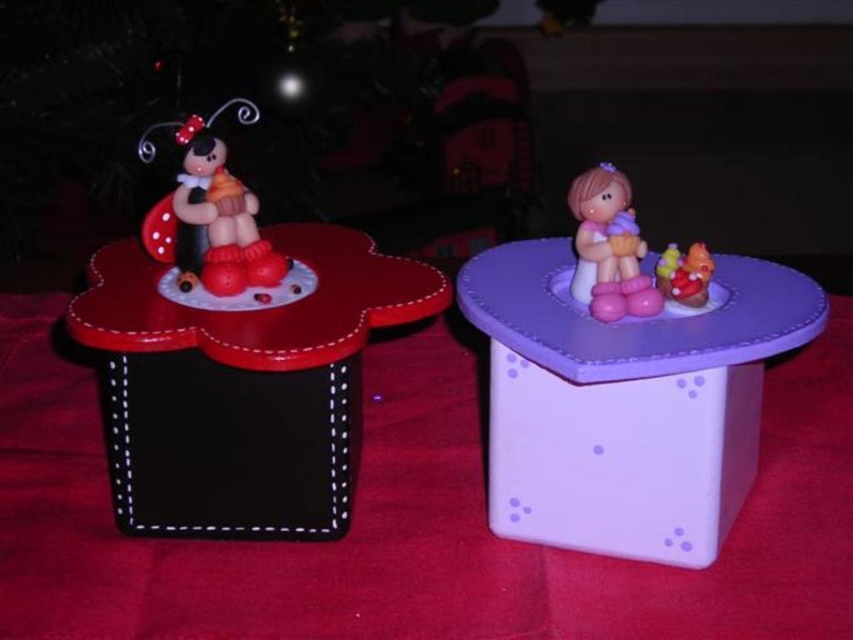
Question: Based on their relative distances, which object is nearer to the purple plastic table at upper center?

Choices:
 (A) pink rubber duck at upper right
 (B) matte black table at left

Answer: (A)

Question: Can you confirm if matte plastic ladybug at left is smaller than pink matte doll at upper center?

Choices:
 (A) no
 (B) yes

Answer: (A)

Question: Does purple plastic table at upper center come in front of matte black table at left?

Choices:
 (A) no
 (B) yes

Answer: (B)

Question: Which object is positioned farthest from the purple plastic table at upper center?

Choices:
 (A) pink matte doll at upper center
 (B) matte black table at left
 (C) matte plastic ladybug at left

Answer: (C)

Question: Which object is closer to the camera taking this photo?

Choices:
 (A) pink matte doll at upper center
 (B) matte black table at left

Answer: (B)

Question: Is matte plastic ladybug at left smaller than pink rubber duck at upper right?

Choices:
 (A) no
 (B) yes

Answer: (A)